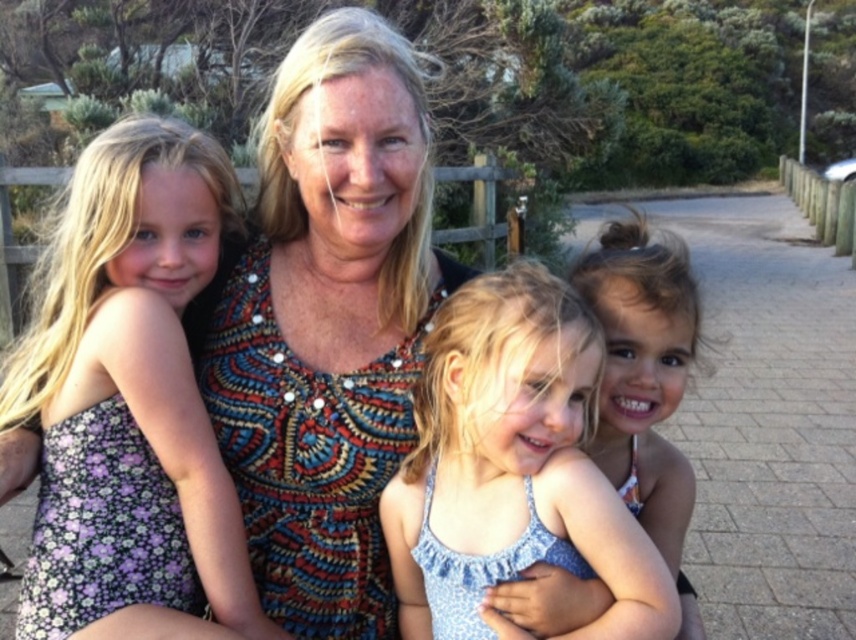
Question: Which point is farther to the camera?

Choices:
 (A) (325, 570)
 (B) (235, 572)

Answer: (A)

Question: Does multicolored beaded dress at center have a larger size compared to blue fabric dress at center?

Choices:
 (A) no
 (B) yes

Answer: (B)

Question: Which object is farther from the camera taking this photo?

Choices:
 (A) purple floral dress at left
 (B) multicolored beaded dress at center

Answer: (B)

Question: Considering the relative positions of purple floral dress at left and blue fabric dress at center in the image provided, where is purple floral dress at left located with respect to blue fabric dress at center?

Choices:
 (A) right
 (B) left

Answer: (B)

Question: Does multicolored beaded dress at center lie in front of purple floral dress at left?

Choices:
 (A) yes
 (B) no

Answer: (B)

Question: Which point is farther to the camera?

Choices:
 (A) (230, 541)
 (B) (363, 140)

Answer: (A)